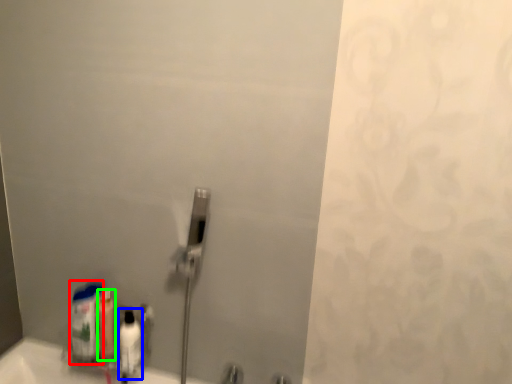
Question: Which object is the farthest from cleaning product (highlighted by a red box)? Choose among these: mouthwash (highlighted by a blue box) or mouthwash (highlighted by a green box).

Choices:
 (A) mouthwash
 (B) mouthwash

Answer: (A)